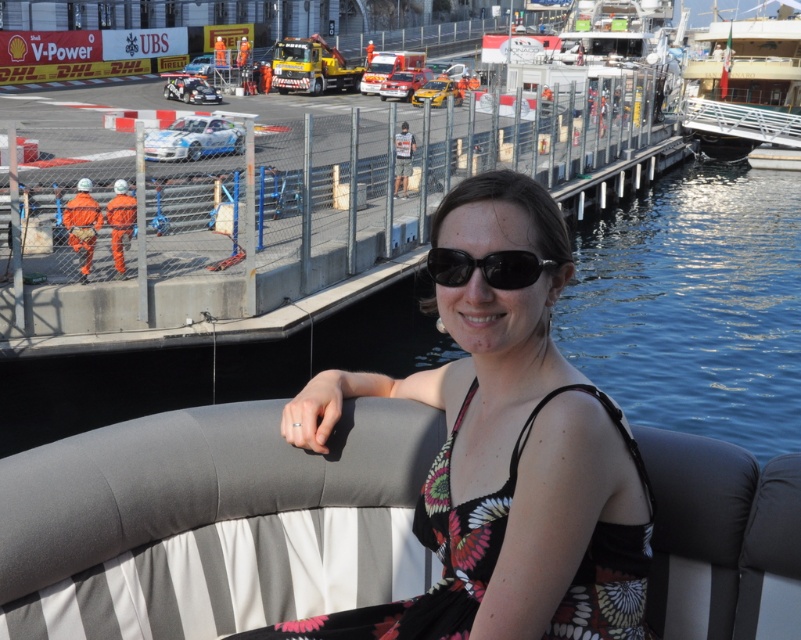
You are a photographer trying to capture both the white glossy yacht at upper right and the black plastic sunglasses at center in a single frame. Based on their sizes in the image, which object would appear larger in your photo?

The white glossy yacht at upper right would appear much larger in the photo than the black plastic sunglasses at center because it is described as much taller.

Based on the photo, you are a photographer trying to capture a clear shot of the black plastic sunglasses at center without the white glossy yacht at upper right blocking the view. Is this possible given their current positions?

The white glossy yacht at upper right is positioned over the black plastic sunglasses at center, so it would block the view. To capture a clear shot of the black plastic sunglasses at center, you would need to adjust your angle or position to avoid the yacht.